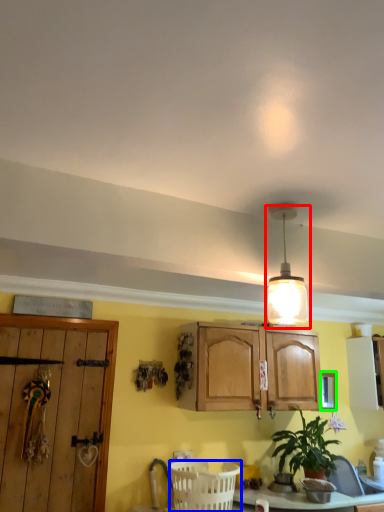
Question: Which object is the closest to the lamp (highlighted by a red box)? Choose among these: basket (highlighted by a blue box) or window (highlighted by a green box).

Choices:
 (A) basket
 (B) window

Answer: (A)